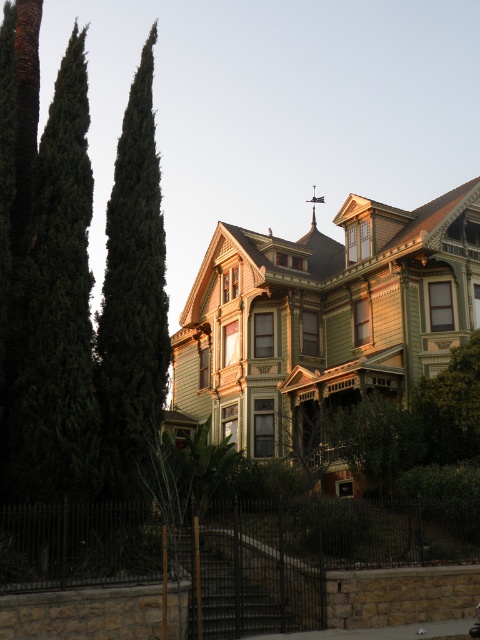
Is green textured tree at left to the left of metallic spire at upper center from the viewer's perspective?

Indeed, green textured tree at left is positioned on the left side of metallic spire at upper center.

Is the position of green textured tree at left more distant than that of metallic spire at upper center?

No.

Between point (139, 360) and point (314, 196), which one is positioned behind?

Positioned behind is point (314, 196).

This screenshot has height=640, width=480. Find the location of `green textured tree at left`. green textured tree at left is located at coordinates (132, 301).